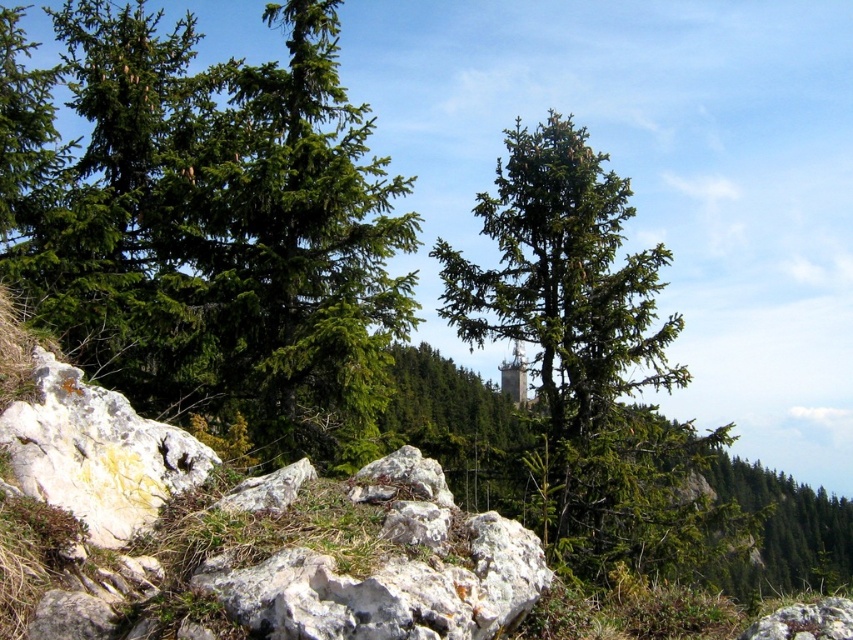
Question: Which object appears closest to the camera in this image?

Choices:
 (A) green matte tree at center
 (B) green matte tree at left

Answer: (A)

Question: Can you confirm if green matte tree at left is positioned to the left of green matte tree at center?

Choices:
 (A) no
 (B) yes

Answer: (B)

Question: Which point appears farthest from the camera in this image?

Choices:
 (A) (637, 301)
 (B) (352, 246)

Answer: (A)

Question: Observing the image, what is the correct spatial positioning of green matte tree at left in reference to green matte tree at center?

Choices:
 (A) above
 (B) below

Answer: (A)

Question: Does green matte tree at left appear on the right side of green matte tree at center?

Choices:
 (A) yes
 (B) no

Answer: (B)